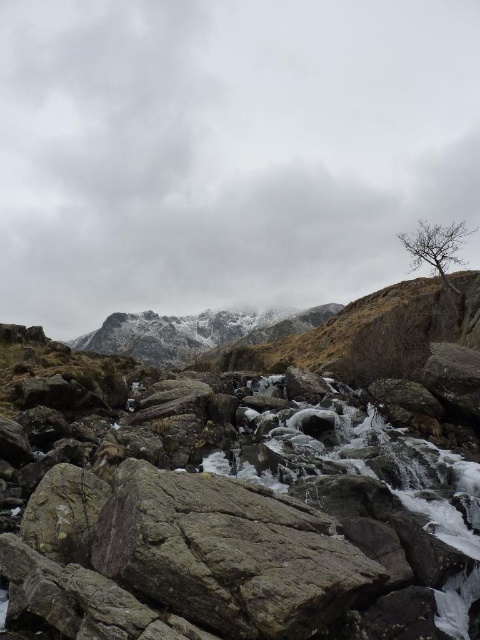
Who is more forward, (336, 525) or (428, 250)?

Point (336, 525)

From the picture: Can you confirm if gray rough rock at center is positioned below bare branches at upper right?

Correct, gray rough rock at center is located below bare branches at upper right.

Where is `gray rough rock at center`? The width and height of the screenshot is (480, 640). gray rough rock at center is located at coordinates (228, 554).